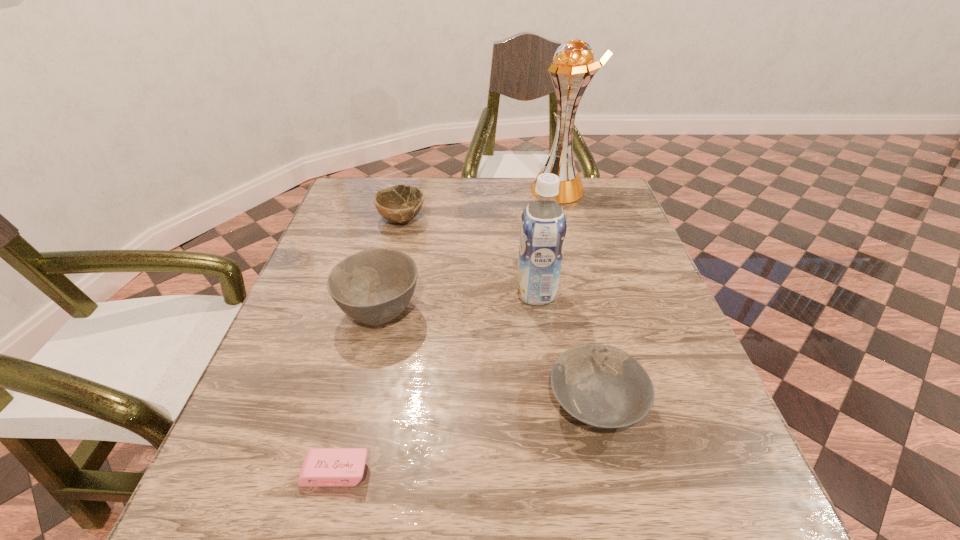
The image size is (960, 540). In the image, there is a desktop. What are the coordinates of `vacant space at the near edge` in the screenshot? It's located at (458, 497).

In order to click on vacant space at the left edge in this screenshot , I will do `click(283, 362)`.

In the image, there is a desktop. In order to click on free space at the right edge in this screenshot , I will do `click(600, 224)`.

Where is `vacant space at the far right corner of the desktop`? vacant space at the far right corner of the desktop is located at coordinates (594, 184).

Locate an element on the screen. This screenshot has height=540, width=960. vacant area that lies between the trophy and the second nearest object is located at coordinates (577, 296).

Identify the location of unoccupied area between the nearest object and the fifth farthest object. The image size is (960, 540). (466, 437).

At what (x,y) coordinates should I click in order to perform the action: click on free area in between the soya milk and the second farthest object. Please return your answer as a coordinate pair (x, y). The height and width of the screenshot is (540, 960). Looking at the image, I should click on (468, 256).

The width and height of the screenshot is (960, 540). I want to click on free space between the nearest bowl and the tallest bowl, so click(x=488, y=357).

Find the location of a particular element. The height and width of the screenshot is (540, 960). free space between the soya milk and the fifth farthest object is located at coordinates (565, 348).

The width and height of the screenshot is (960, 540). Find the location of `vacant area that lies between the fourth shortest object and the tallest object`. vacant area that lies between the fourth shortest object and the tallest object is located at coordinates (469, 251).